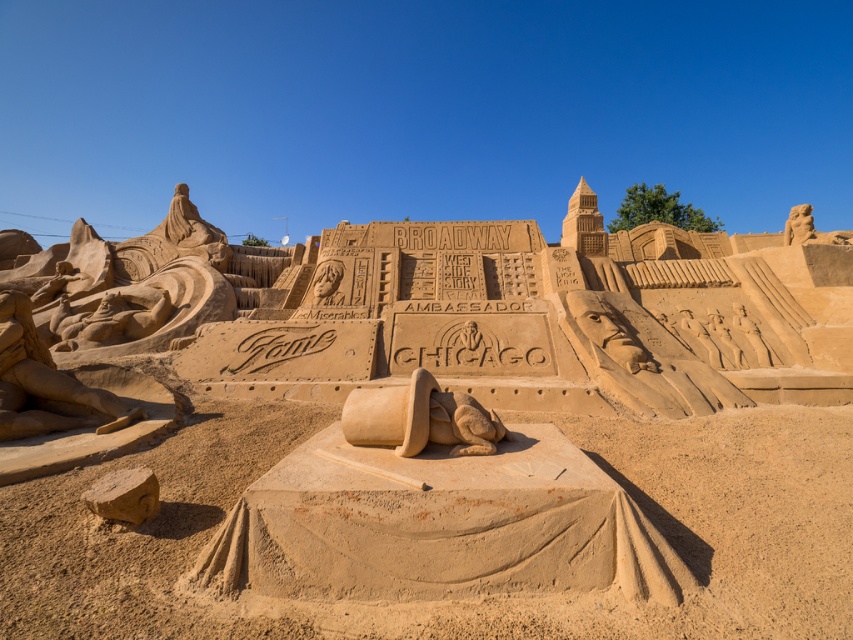
Can you confirm if smooth sand figure at left is positioned to the right of smooth sand hat at center?

In fact, smooth sand figure at left is to the left of smooth sand hat at center.

Is smooth sand figure at left below smooth sand hat at center?

No, smooth sand figure at left is not below smooth sand hat at center.

Identify the location of smooth sand figure at left. The width and height of the screenshot is (853, 640). (44, 381).

Does smooth sand figure at left have a smaller size compared to smooth sand figure at center-right?

No, smooth sand figure at left is not smaller than smooth sand figure at center-right.

Does point (10, 435) come behind point (752, 326)?

No, it is in front of (752, 326).

The image size is (853, 640). Identify the location of smooth sand figure at left. (44, 381).

Looking at this image, is smooth sand hat at center below smooth sand figure at center-right?

Correct, smooth sand hat at center is located below smooth sand figure at center-right.

Describe the element at coordinates (421, 419) in the screenshot. This screenshot has height=640, width=853. I see `smooth sand hat at center` at that location.

At what (x,y) coordinates should I click in order to perform the action: click on smooth sand hat at center. Please return your answer as a coordinate pair (x, y). Looking at the image, I should click on (421, 419).